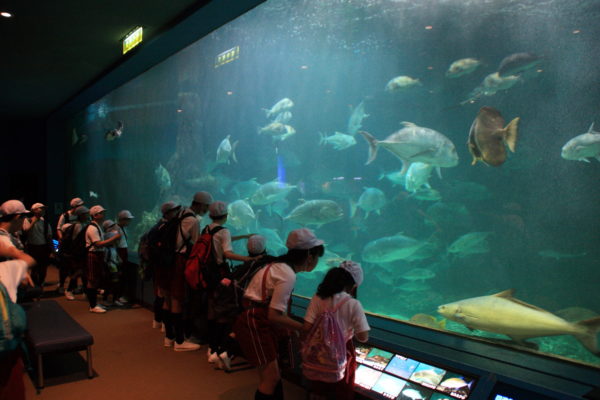
Find the location of a particular element. screen is located at coordinates (360, 355), (375, 358), (367, 378), (386, 384), (401, 373), (429, 378), (416, 390), (437, 397), (450, 382), (498, 396).